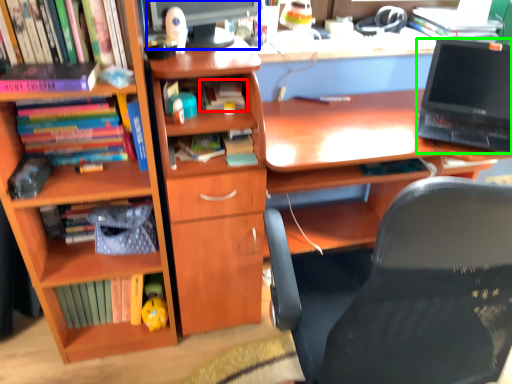
Question: Which object is the farthest from book (highlighted by a red box)? Choose among these: computer monitor (highlighted by a blue box) or laptop (highlighted by a green box).

Choices:
 (A) computer monitor
 (B) laptop

Answer: (B)